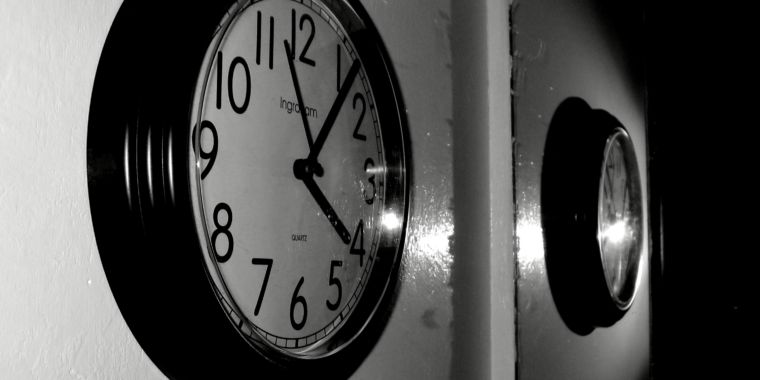
I want to click on white wall, so click(x=59, y=228).